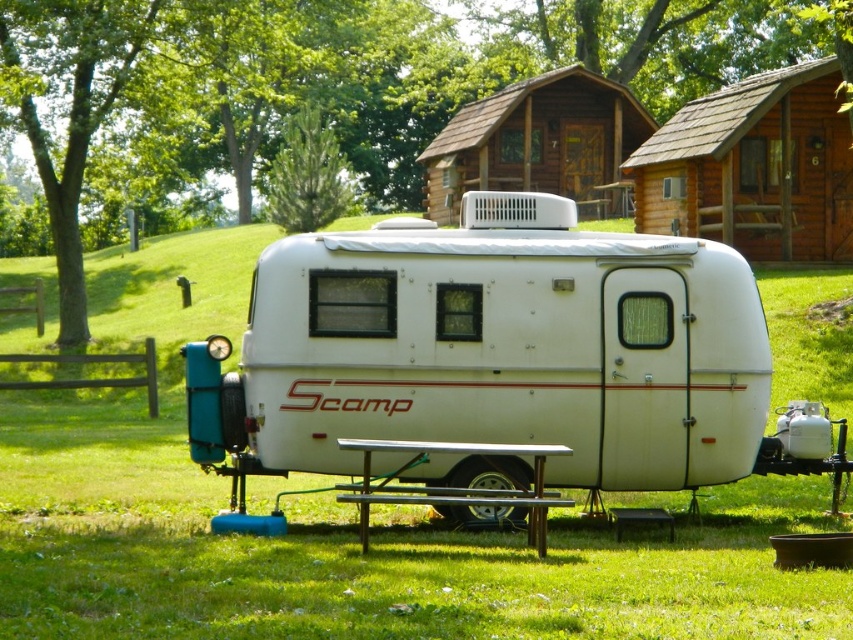
You are standing at the picnic table in front of the Scamp trailer. Which direction should you face to see the brown wooden log cabin at upper right?

You should face towards the upper right direction to see the brown wooden log cabin at upper right as it is located at point (x=753, y=168).

You are standing at the picnic table in front of the Scamp trailer and looking towards the brown wooden log cabin at upper right and the green leafy tree at upper center. Which object is positioned lower in the image?

The brown wooden log cabin at upper right is below the green leafy tree at upper center, so the brown wooden log cabin at upper right is positioned lower in the image.